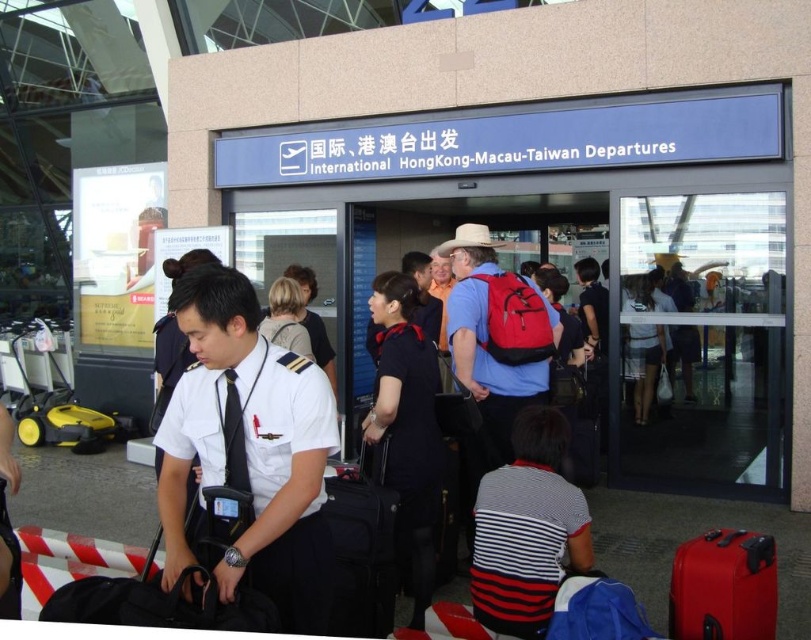
Is matte red suitcase at lower right closer to camera compared to blonde hair at center?

That is True.

Is matte red suitcase at lower right further to camera compared to blonde hair at center?

No, it is not.

Is point (752, 540) more distant than point (279, 314)?

No, it is in front of (279, 314).

At what (x,y) coordinates should I click in order to perform the action: click on matte red suitcase at lower right. Please return your answer as a coordinate pair (x, y). The height and width of the screenshot is (640, 811). Looking at the image, I should click on (723, 586).

Is white cotton shirt at center thinner than matte red suitcase at lower right?

No.

Who is lower down, white cotton shirt at center or matte red suitcase at lower right?

matte red suitcase at lower right

Between point (242, 353) and point (757, 589), which one is positioned in front?

Positioned in front is point (242, 353).

Locate an element on the screen. white cotton shirt at center is located at coordinates (252, 464).

Who is taller, black fabric suitcase at lower center or light brown leather jacket at center?

Standing taller between the two is light brown leather jacket at center.

Between black fabric suitcase at lower center and light brown leather jacket at center, which one is positioned higher?

light brown leather jacket at center is higher up.

Which is behind, point (346, 611) or point (329, 355)?

Point (329, 355)

Find the location of a particular element. Image resolution: width=811 pixels, height=640 pixels. black fabric suitcase at lower center is located at coordinates (361, 548).